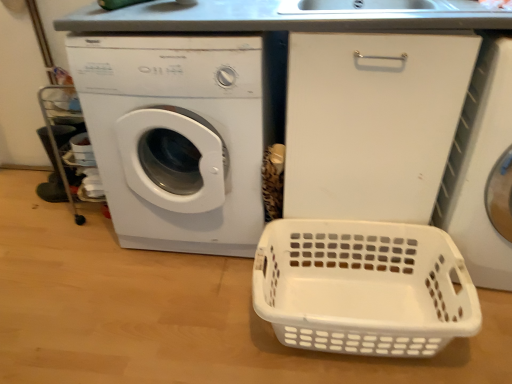
Question: Considering the positions of white plastic washing machine at left, arranged as the second washing machine when viewed from the right, and white plastic washing machine at right, the 1th washing machine from the right, in the image, is white plastic washing machine at left, arranged as the second washing machine when viewed from the right, wider or thinner than white plastic washing machine at right, the 1th washing machine from the right,?

Choices:
 (A) wide
 (B) thin

Answer: (B)

Question: Considering their positions, is white plastic washing machine at left, arranged as the second washing machine when viewed from the right, located in front of or behind white plastic washing machine at right, acting as the 2th washing machine starting from the left?

Choices:
 (A) front
 (B) behind

Answer: (B)

Question: Which object is positioned farthest from the white plastic basket at lower right?

Choices:
 (A) white plastic washing machine at right, the 1th washing machine from the right
 (B) white plastic washing machine at left, the 1th washing machine from the left

Answer: (B)

Question: Based on their relative distances, which object is nearer to the white plastic washing machine at left, arranged as the second washing machine when viewed from the right?

Choices:
 (A) white plastic washing machine at right, acting as the 2th washing machine starting from the left
 (B) white plastic basket at lower right

Answer: (B)